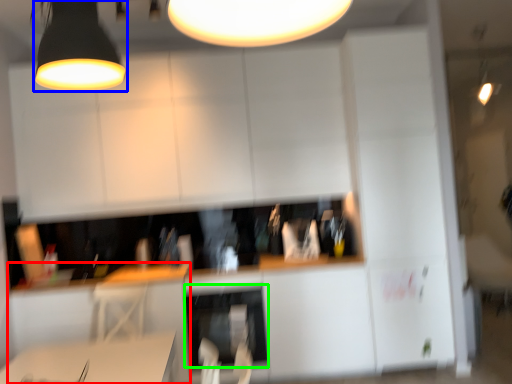
Question: Considering the real-world distances, which object is closest to computer desk (highlighted by a red box)? lamp (highlighted by a blue box) or dish washer (highlighted by a green box).

Choices:
 (A) lamp
 (B) dish washer

Answer: (B)